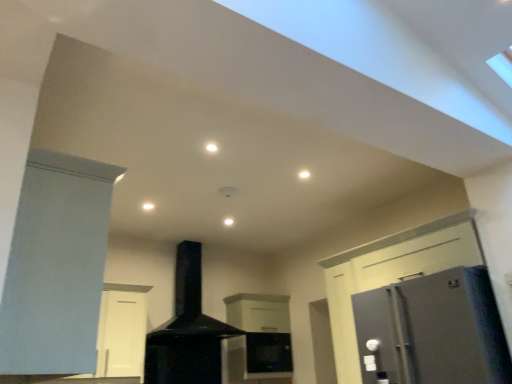
Question: Which is correct: white matte cabinet at center, placed as the second cabinetry when sorted from left to right, is inside matte white cabinet at left, the 1th cabinetry viewed from the left, or outside of it?

Choices:
 (A) outside
 (B) inside

Answer: (A)

Question: Considering the positions of white matte cabinet at center, the 1th cabinetry when ordered from right to left, and matte white cabinet at left, which is counted as the second cabinetry, starting from the back, in the image, is white matte cabinet at center, the 1th cabinetry when ordered from right to left, wider or thinner than matte white cabinet at left, which is counted as the second cabinetry, starting from the back,?

Choices:
 (A) wide
 (B) thin

Answer: (A)

Question: Considering the real-world distances, which object is closest to the satin silver refrigerator at right?

Choices:
 (A) matte white cabinet at left, the 1th cabinetry viewed from the left
 (B) black matte chimney at center
 (C) white matte cabinet at center, the first cabinetry viewed from the back

Answer: (A)

Question: Which object is positioned farthest from the matte white cabinet at left, which is counted as the second cabinetry, starting from the back?

Choices:
 (A) satin silver refrigerator at right
 (B) white matte cabinet at center, the 1th cabinetry when ordered from right to left
 (C) black matte chimney at center

Answer: (B)